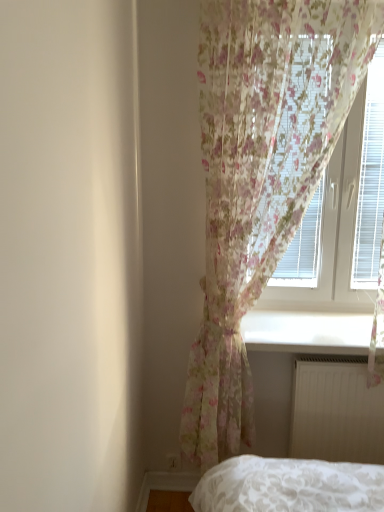
Locate an element on the screen. empty space that is ontop of white smooth window sill at lower center is located at coordinates (309, 321).